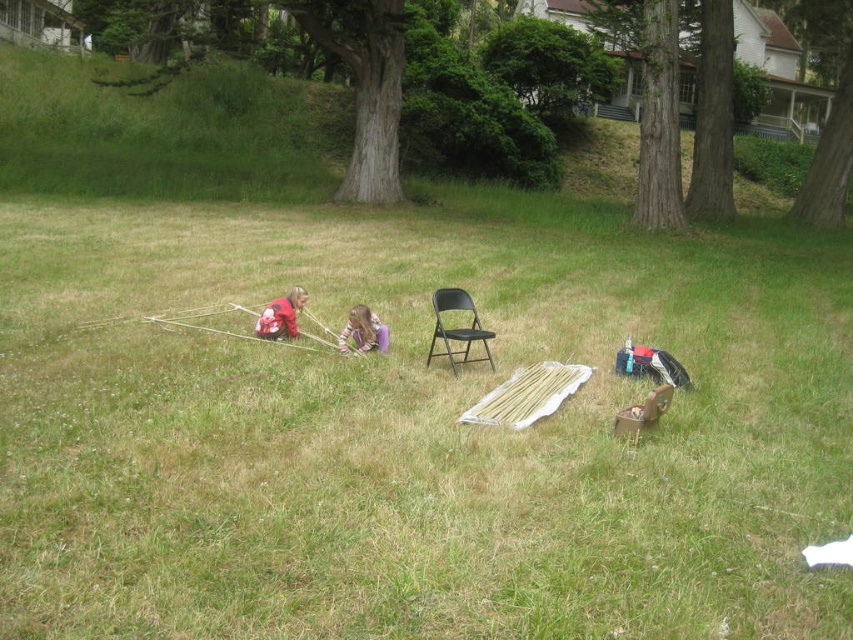
Is black plastic chair at center in front of wooden chair at lower right?

No, black plastic chair at center is further to the viewer.

Which is behind, point (471, 333) or point (647, 422)?

The point (471, 333) is behind.

What do you see at coordinates (457, 328) in the screenshot? I see `black plastic chair at center` at bounding box center [457, 328].

Image resolution: width=853 pixels, height=640 pixels. I want to click on black plastic chair at center, so (x=457, y=328).

Can you confirm if wooden chair at lower right is positioned below red matte jacket at center?

Indeed, wooden chair at lower right is positioned under red matte jacket at center.

This screenshot has width=853, height=640. I want to click on wooden chair at lower right, so click(x=643, y=413).

This screenshot has height=640, width=853. I want to click on wooden chair at lower right, so click(x=643, y=413).

Between green grassy at center and purple fabric at center, which one appears on the right side from the viewer's perspective?

Positioned to the right is green grassy at center.

Who is positioned more to the left, green grassy at center or purple fabric at center?

purple fabric at center

This screenshot has height=640, width=853. Identify the location of green grassy at center. (416, 429).